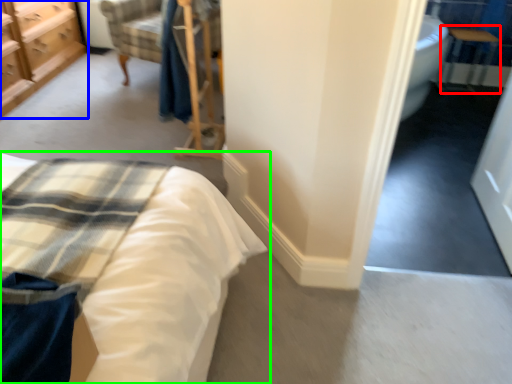
Question: Considering the real-world distances, which object is farthest from table (highlighted by a red box)? chest of drawers (highlighted by a blue box) or bed (highlighted by a green box)?

Choices:
 (A) chest of drawers
 (B) bed

Answer: (A)